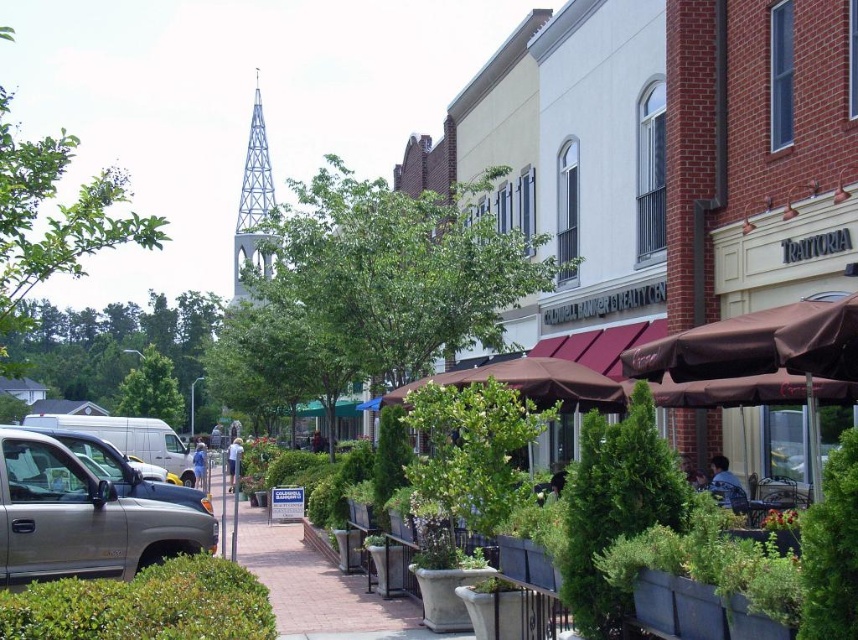
Who is lower down, gold metallic truck at lower left or brown fabric umbrella at center?

gold metallic truck at lower left is lower down.

Does gold metallic truck at lower left have a lesser height compared to brown fabric umbrella at center?

Indeed, gold metallic truck at lower left has a lesser height compared to brown fabric umbrella at center.

The width and height of the screenshot is (858, 640). I want to click on gold metallic truck at lower left, so click(x=80, y=518).

I want to click on gold metallic truck at lower left, so click(x=80, y=518).

Who is more forward, (0, 566) or (723, 401)?

Point (0, 566) is more forward.

I want to click on gold metallic truck at lower left, so click(x=80, y=518).

Is brown fabric umbrella at right positioned before brown fabric umbrella at center?

Yes, it is.

Does brown fabric umbrella at right have a greater width compared to brown fabric umbrella at center?

No, brown fabric umbrella at right is not wider than brown fabric umbrella at center.

Image resolution: width=858 pixels, height=640 pixels. Describe the element at coordinates (750, 364) in the screenshot. I see `brown fabric umbrella at right` at that location.

I want to click on brown fabric umbrella at right, so click(x=750, y=364).